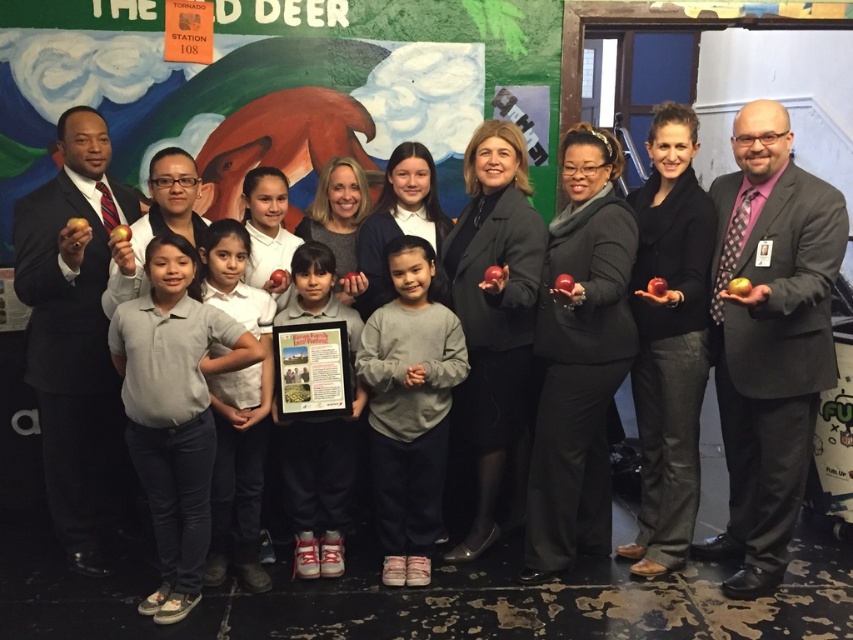
Is point (70, 333) behind point (173, 422)?

Yes.

Between matte black suit at left and gray cotton shirt at center, which one appears on the left side from the viewer's perspective?

From the viewer's perspective, matte black suit at left appears more on the left side.

What do you see at coordinates (74, 333) in the screenshot?
I see `matte black suit at left` at bounding box center [74, 333].

The image size is (853, 640). In order to click on matte black suit at left in this screenshot , I will do `click(74, 333)`.

From the picture: Can you confirm if matte black suit at center is wider than gray fleece sweatshirt at center?

Indeed, matte black suit at center has a greater width compared to gray fleece sweatshirt at center.

Does matte black suit at center come behind gray fleece sweatshirt at center?

Result: No, matte black suit at center is in front of gray fleece sweatshirt at center.

The width and height of the screenshot is (853, 640). I want to click on matte black suit at center, so click(x=769, y=337).

Which of these two, matte black suit at center or gray cotton shirt at center, stands taller?

With more height is matte black suit at center.

Is matte black suit at center above gray cotton shirt at center?

Correct, matte black suit at center is located above gray cotton shirt at center.

Between point (726, 467) and point (167, 518), which one is positioned behind?

The point (726, 467) is behind.

At what (x,y) coordinates should I click in order to perform the action: click on matte black suit at center. Please return your answer as a coordinate pair (x, y). This screenshot has width=853, height=640. Looking at the image, I should click on (769, 337).